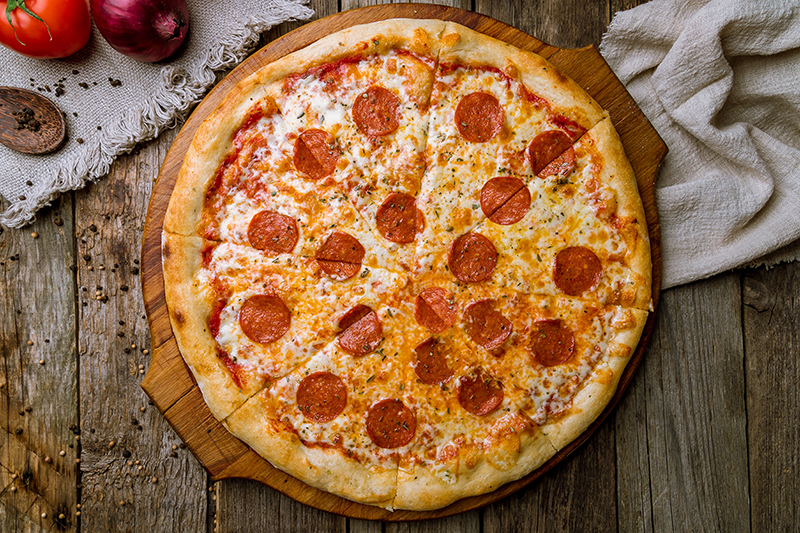
Identify the location of wooden table planks. (785, 384), (706, 395), (565, 499), (416, 526), (269, 502), (150, 474), (41, 394).